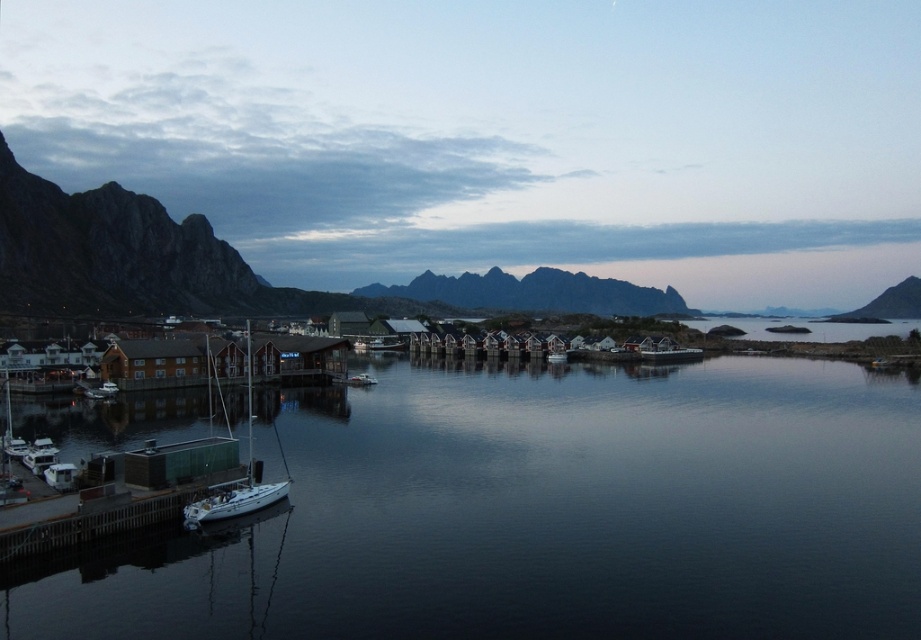
Question: Which point is farther from the camera taking this photo?

Choices:
 (A) (904, 292)
 (B) (552, 337)
 (C) (207, 516)
 (D) (531, 449)

Answer: (A)

Question: Can you confirm if dark reflective water at center is positioned to the left of white matte sailboat at lower left?

Choices:
 (A) no
 (B) yes

Answer: (A)

Question: Which of the following is the closest to the observer?

Choices:
 (A) rugged stone mountain at right
 (B) dark reflective water at center

Answer: (B)

Question: Is rugged stone mountains at center further to camera compared to white matte boat at center?

Choices:
 (A) yes
 (B) no

Answer: (A)

Question: Which object appears closest to the camera in this image?

Choices:
 (A) white matte boat at center
 (B) rugged stone mountain at right
 (C) dark reflective water at center

Answer: (C)

Question: Does rugged stone mountains at center appear on the left side of white matte boat at center?

Choices:
 (A) yes
 (B) no

Answer: (B)